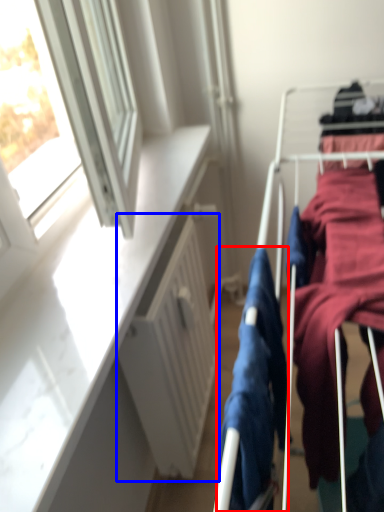
Question: Which of the following is the farthest to the observer, clothing (highlighted by a red box) or radiator (highlighted by a blue box)?

Choices:
 (A) clothing
 (B) radiator

Answer: (B)